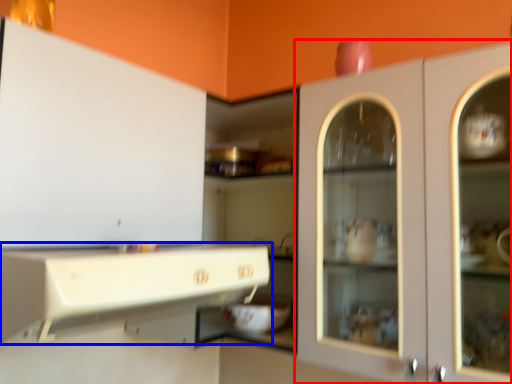
Question: Which of the following is the closest to the observer, cabinetry (highlighted by a red box) or cabinetry (highlighted by a blue box)?

Choices:
 (A) cabinetry
 (B) cabinetry

Answer: (B)